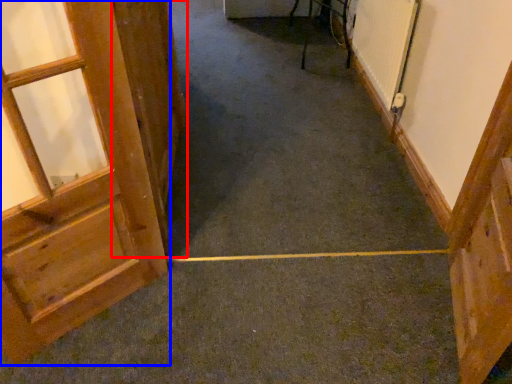
Question: Which point is closer to the camera, door (highlighted by a red box) or door (highlighted by a blue box)?

Choices:
 (A) door
 (B) door

Answer: (B)